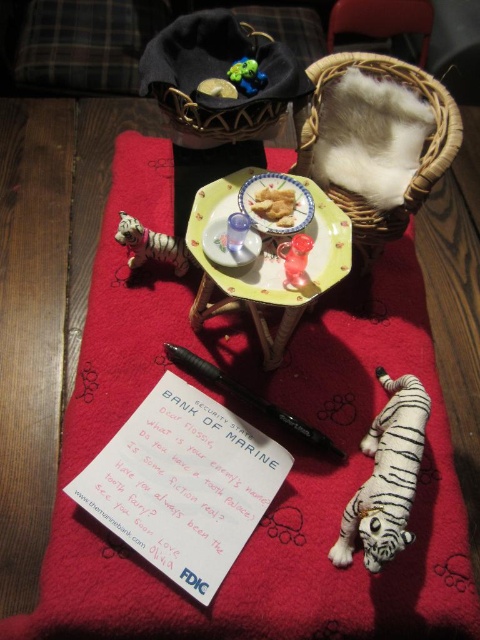
Who is lower down, porcelain plate at center or woven wicker basket at upper right?

Positioned lower is porcelain plate at center.

Is porcelain plate at center below woven wicker basket at upper right?

Yes.

You are a GUI agent. You are given a task and a screenshot of the screen. Output one action in this format:
    pyautogui.click(x=<x>, y=<y>)
    Task: Click on the porcelain plate at center
    This screenshot has height=640, width=480.
    Given the screenshot: What is the action you would take?
    pyautogui.click(x=266, y=262)

Between point (388, 515) and point (289, 193), which one is positioned in front?

Point (388, 515) is more forward.

Is white plush tiger at lower right to the right of yellow crumbly cake at center from the viewer's perspective?

Yes, white plush tiger at lower right is to the right of yellow crumbly cake at center.

The image size is (480, 640). I want to click on white plush tiger at lower right, so click(386, 476).

Can you confirm if black fabric basket at upper center is wider than translucent plastic toy at center?

Correct, the width of black fabric basket at upper center exceeds that of translucent plastic toy at center.

At what (x,y) coordinates should I click in order to perform the action: click on black fabric basket at upper center. Please return your answer as a coordinate pair (x, y). This screenshot has height=640, width=480. Looking at the image, I should click on (220, 80).